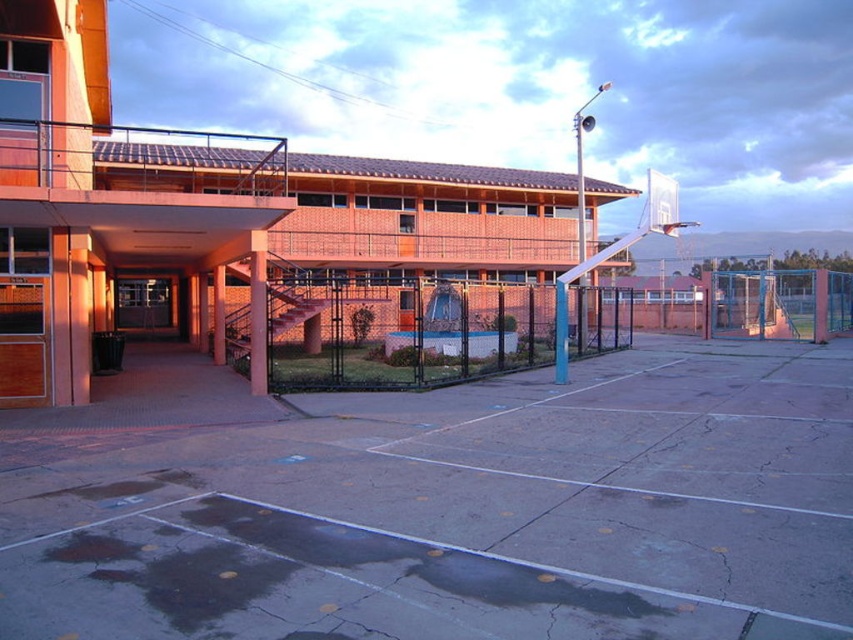
Is point (637, 624) in front of point (276, 349)?

Yes, it is.

Who is shorter, concrete at center or black wire mesh fence at center?

concrete at center is shorter.

Locate an element on the screen. The image size is (853, 640). concrete at center is located at coordinates (x=444, y=504).